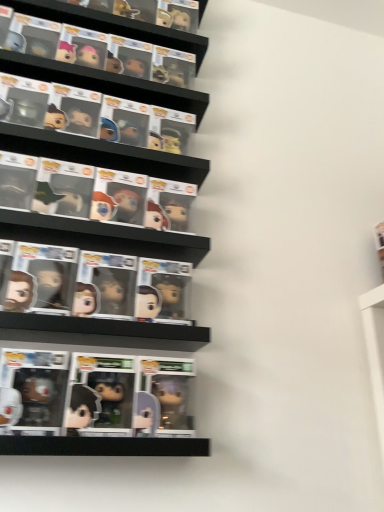
Question: Which direction should I rotate to look at translucent plastic figure at center, which ranks as the first comic book in left-to-right order?

Choices:
 (A) left
 (B) right

Answer: (A)

Question: Can you confirm if shiny plastic figure at center, arranged as the first comic book when viewed from the right, is smaller than translucent plastic figure at center, which ranks as the second comic book in right-to-left order?

Choices:
 (A) yes
 (B) no

Answer: (B)

Question: Is shiny plastic figure at center, arranged as the first comic book when viewed from the right, further to camera compared to translucent plastic figure at center, which ranks as the first comic book in left-to-right order?

Choices:
 (A) yes
 (B) no

Answer: (A)

Question: Does shiny plastic figure at center, the 2th comic book in the left-to-right sequence, lie in front of translucent plastic figure at center, which ranks as the second comic book in right-to-left order?

Choices:
 (A) no
 (B) yes

Answer: (A)

Question: Could translucent plastic figure at center, which ranks as the second comic book in right-to-left order, be considered to be inside shiny plastic figure at center, the 2th comic book in the left-to-right sequence?

Choices:
 (A) yes
 (B) no

Answer: (B)

Question: Can you confirm if shiny plastic figure at center, the 2th comic book in the left-to-right sequence, is wider than translucent plastic figure at center, which ranks as the first comic book in left-to-right order?

Choices:
 (A) no
 (B) yes

Answer: (B)

Question: Is shiny plastic figure at center, the 2th comic book in the left-to-right sequence, not near translucent plastic figure at center, which ranks as the second comic book in right-to-left order?

Choices:
 (A) yes
 (B) no

Answer: (B)

Question: Considering the relative positions of translucent plastic figure at center, which ranks as the second comic book in right-to-left order, and shiny plastic figure at center, arranged as the first comic book when viewed from the right, in the image provided, is translucent plastic figure at center, which ranks as the second comic book in right-to-left order, behind shiny plastic figure at center, arranged as the first comic book when viewed from the right,?

Choices:
 (A) no
 (B) yes

Answer: (A)

Question: Is translucent plastic figure at center, which ranks as the second comic book in right-to-left order, to the right of shiny plastic figure at center, arranged as the first comic book when viewed from the right, from the viewer's perspective?

Choices:
 (A) yes
 (B) no

Answer: (B)

Question: Is shiny plastic figure at center, the 2th comic book in the left-to-right sequence, inside translucent plastic figure at center, which ranks as the second comic book in right-to-left order?

Choices:
 (A) yes
 (B) no

Answer: (B)

Question: Can you confirm if translucent plastic figure at center, which ranks as the second comic book in right-to-left order, is bigger than shiny plastic figure at center, arranged as the first comic book when viewed from the right?

Choices:
 (A) no
 (B) yes

Answer: (A)

Question: Are translucent plastic figure at center, which ranks as the first comic book in left-to-right order, and shiny plastic figure at center, the 2th comic book in the left-to-right sequence, far apart?

Choices:
 (A) no
 (B) yes

Answer: (A)

Question: From the image's perspective, is translucent plastic figure at center, which ranks as the first comic book in left-to-right order, on top of shiny plastic figure at center, arranged as the first comic book when viewed from the right?

Choices:
 (A) yes
 (B) no

Answer: (A)

Question: Looking at their shapes, would you say translucent plastic figure at center, which ranks as the second comic book in right-to-left order, is wider or thinner than shiny plastic figure at center, the 2th comic book in the left-to-right sequence?

Choices:
 (A) thin
 (B) wide

Answer: (A)